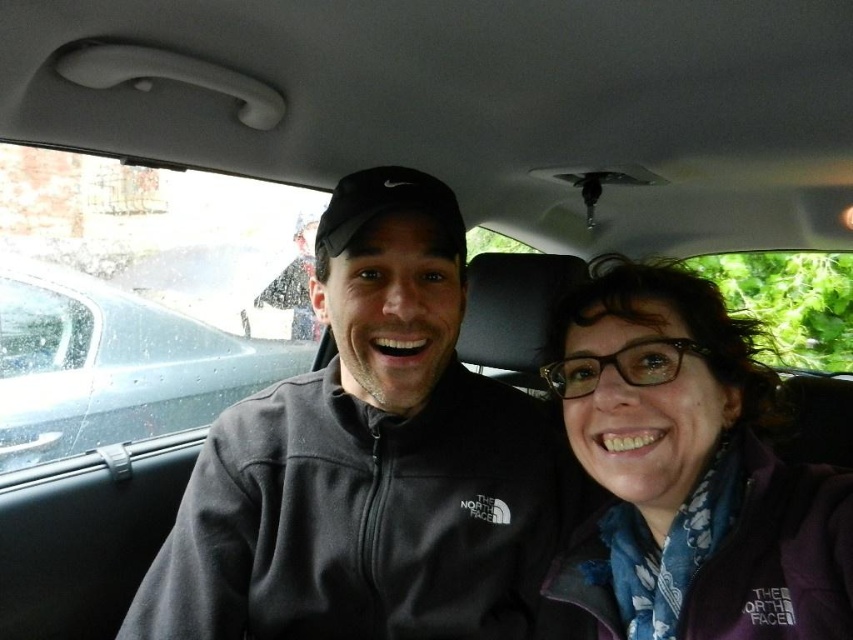
Between dark gray fleece jacket at center and purple fleece jacket at center, which one appears on the left side from the viewer's perspective?

dark gray fleece jacket at center is more to the left.

Which is below, dark gray fleece jacket at center or purple fleece jacket at center?

Positioned lower is dark gray fleece jacket at center.

Describe the element at coordinates (370, 461) in the screenshot. I see `dark gray fleece jacket at center` at that location.

Image resolution: width=853 pixels, height=640 pixels. What are the coordinates of `dark gray fleece jacket at center` in the screenshot? It's located at (370, 461).

Is point (466, 576) less distant than point (125, 413)?

Yes.

Can you confirm if dark gray fleece jacket at center is positioned to the right of metallic gray car at left?

Correct, you'll find dark gray fleece jacket at center to the right of metallic gray car at left.

Is point (335, 468) positioned in front of point (178, 365)?

Yes, it is.

Identify the location of dark gray fleece jacket at center. This screenshot has height=640, width=853. (370, 461).

Which is in front, point (671, 440) or point (71, 349)?

Point (671, 440) is in front.

Who is taller, purple fleece jacket at center or metallic gray car at left?

metallic gray car at left is taller.

The width and height of the screenshot is (853, 640). Identify the location of purple fleece jacket at center. (686, 474).

This screenshot has width=853, height=640. I want to click on purple fleece jacket at center, so click(x=686, y=474).